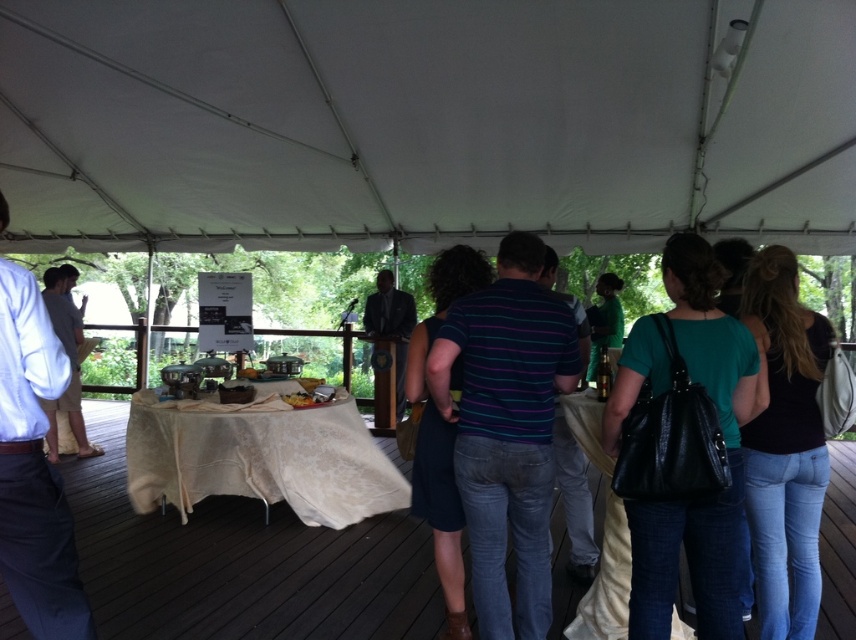
You are standing at the entrance of the tent and want to locate the striped cotton shirt at center. According to the coordinates provided, in which direction should you walk to find it?

The striped cotton shirt at center is located at coordinates point (507, 429). Since the coordinate system typically has (0, 0) at the bottom left corner, you should walk towards the right and slightly upwards from the entrance to reach it.

Consider the image. You are standing at the back of the event and want to greet both the person wearing the striped cotton shirt at center and the person in the light blue shirt at left. Which one should you approach first to reach them more quickly?

You should approach the striped cotton shirt at center first because it is closer to you than the light blue shirt at left, which is further away.

You are a photographer at the event and want to capture a photo of the dark suit at center without the light brown shorts at left blocking it. Can you adjust your position to achieve this?

The light brown shorts at left is in front of the dark suit at center, so moving your position to the side or behind the light brown shorts at left would allow you to capture the dark suit at center without obstruction.